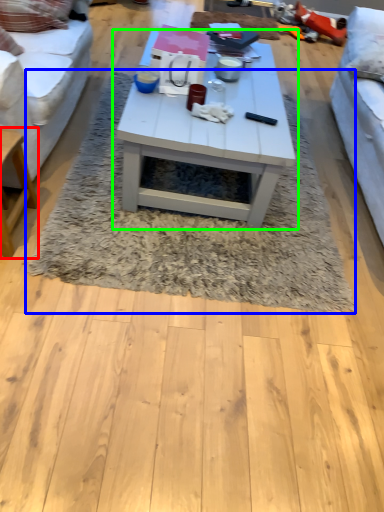
Question: Which object is the farthest from table (highlighted by a red box)? Choose among these: mat (highlighted by a blue box) or coffee table (highlighted by a green box).

Choices:
 (A) mat
 (B) coffee table

Answer: (B)